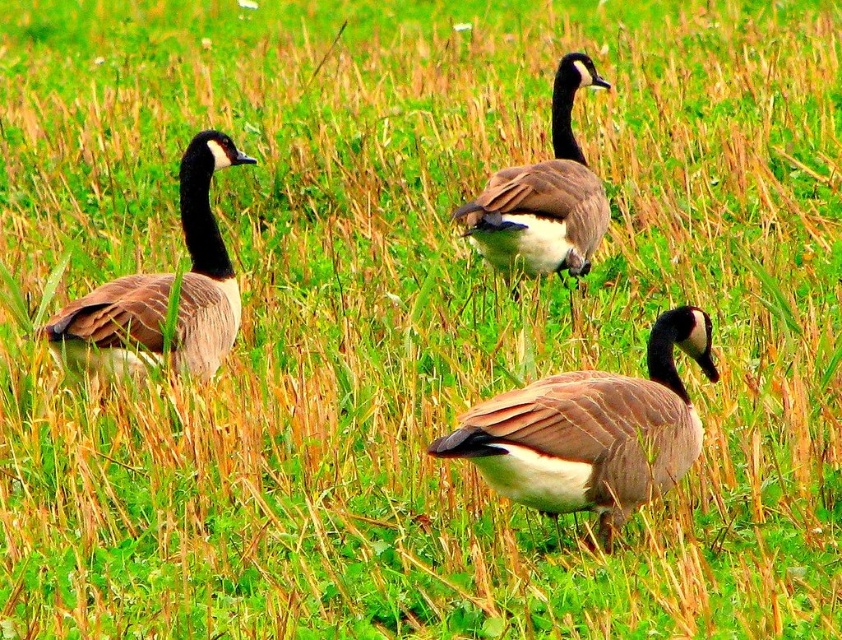
From the picture: Is the position of brown matte duck at center more distant than that of brown matte goose at center?

That is False.

Can you confirm if brown matte duck at center is positioned above brown matte goose at center?

No.

Where is `brown matte duck at center`? brown matte duck at center is located at coordinates click(590, 429).

Is brown matte duck at center above brown matte duck at left?

No, brown matte duck at center is not above brown matte duck at left.

What do you see at coordinates (590, 429) in the screenshot?
I see `brown matte duck at center` at bounding box center [590, 429].

Where is `brown matte duck at center`? brown matte duck at center is located at coordinates coord(590,429).

Does point (99, 305) lie in front of point (533, 262)?

Yes, point (99, 305) is closer to viewer.

Does brown matte duck at left have a smaller size compared to brown matte goose at center?

Indeed, brown matte duck at left has a smaller size compared to brown matte goose at center.

Measure the distance between point (206, 141) and camera.

Point (206, 141) is 4.28 meters away from camera.

Where is `brown matte duck at left`? This screenshot has height=640, width=842. brown matte duck at left is located at coordinates [x=163, y=291].